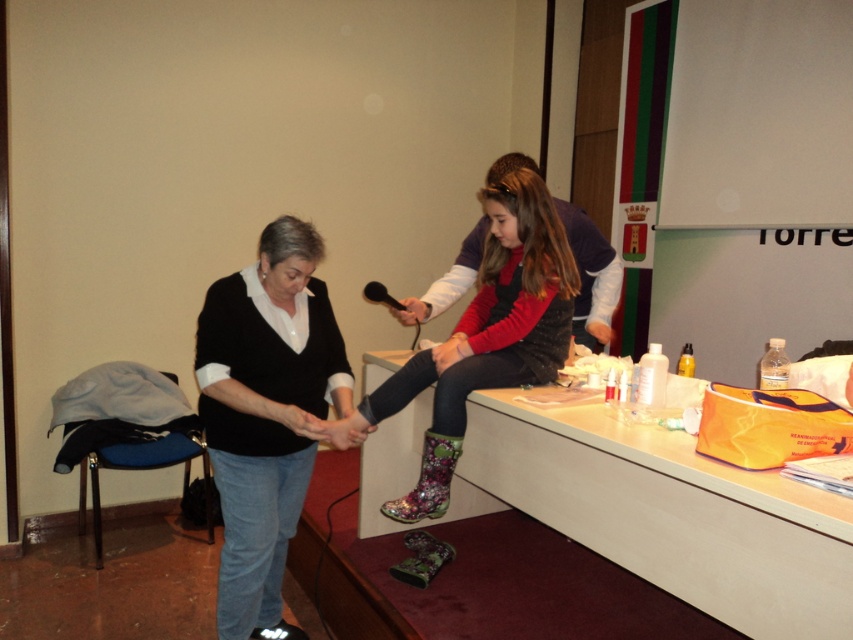
Which is in front, point (277, 417) or point (416, 314)?

Positioned in front is point (277, 417).

Can you confirm if matte black hand at lower center is positioned to the right of matte black hand at center?

In fact, matte black hand at lower center is to the left of matte black hand at center.

Which is in front, point (312, 413) or point (428, 307)?

Point (312, 413) is in front.

You are a GUI agent. You are given a task and a screenshot of the screen. Output one action in this format:
    pyautogui.click(x=<x>, y=<y>)
    Task: Click on the matte black hand at lower center
    The height and width of the screenshot is (640, 853).
    Given the screenshot: What is the action you would take?
    pyautogui.click(x=300, y=420)

Does black matte sweater at center lie in front of matte black hand at lower center?

Yes, black matte sweater at center is in front of matte black hand at lower center.

Can you confirm if black matte sweater at center is positioned to the right of matte black hand at lower center?

Incorrect, black matte sweater at center is not on the right side of matte black hand at lower center.

Who is more forward, (x=306, y=362) or (x=293, y=417)?

Point (x=293, y=417)

Where is `black matte sweater at center`? This screenshot has height=640, width=853. black matte sweater at center is located at coordinates (265, 413).

Is floral rubber boots at center smaller than matte black hand at center?

Incorrect, floral rubber boots at center is not smaller in size than matte black hand at center.

Which is behind, point (500, 204) or point (416, 314)?

Positioned behind is point (416, 314).

Where is `floral rubber boots at center`? The height and width of the screenshot is (640, 853). floral rubber boots at center is located at coordinates (485, 337).